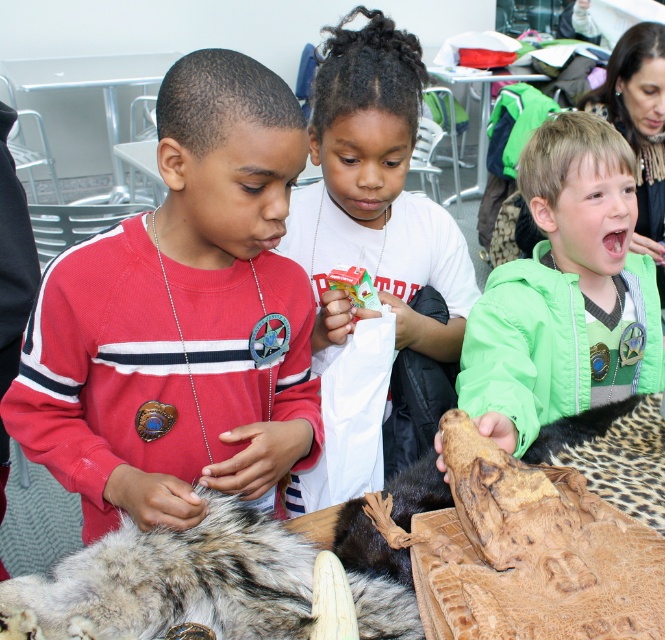
Question: Can you confirm if green fabric jacket at center is bigger than white matte paper bag at center?

Choices:
 (A) no
 (B) yes

Answer: (A)

Question: Can you confirm if red sweater at center is positioned below white matte paper bag at center?

Choices:
 (A) no
 (B) yes

Answer: (B)

Question: Among these points, which one is farthest from the camera?

Choices:
 (A) (78, 550)
 (B) (106, 292)
 (C) (444, 234)

Answer: (C)

Question: Which object appears farthest from the camera in this image?

Choices:
 (A) green fabric jacket at center
 (B) red sweater at center
 (C) fuzzy fur pelt at lower left
 (D) white matte paper bag at center

Answer: (D)

Question: Which of the following is the farthest from the observer?

Choices:
 (A) red sweater at center
 (B) green fabric jacket at center
 (C) fuzzy fur pelt at lower left

Answer: (A)

Question: From the image, what is the correct spatial relationship of green fabric jacket at center in relation to white matte paper bag at center?

Choices:
 (A) right
 (B) left

Answer: (A)